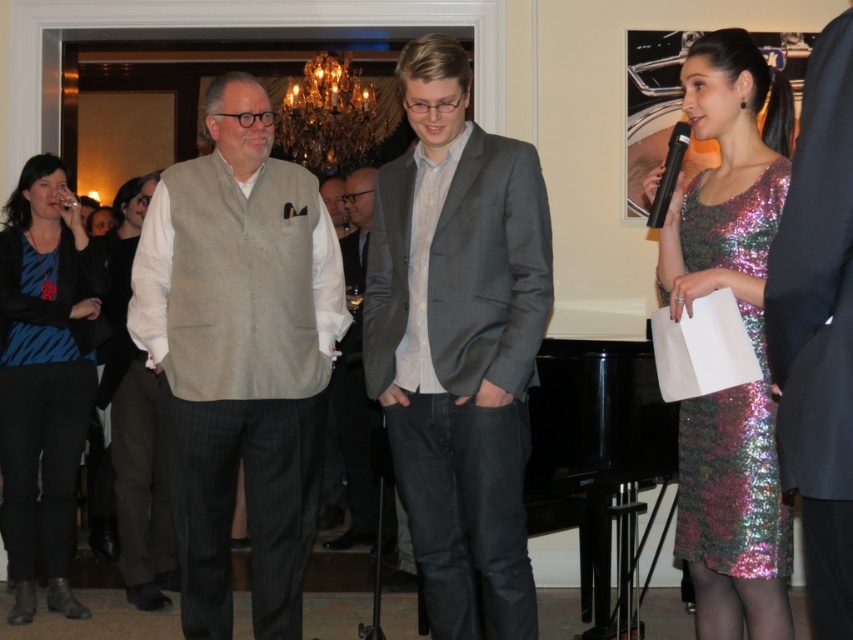
You are a photographer trying to capture a candid shot of the two people represented by the points in the image. The first point is at coordinate point (109, 321) and the second is at point (352, 218). Since you want to focus on the person closer to the camera, which point should you aim your camera at?

Point (109, 321) is closer to the camera than point (352, 218), so you should aim your camera at point (109, 321) to focus on the person closer to the camera.

You are standing at the point labeled as point (717, 561) and want to move to the exit located at point (486, 595). Is the exit directly in front of you or behind you?

The exit at point (486, 595) is behind point (717, 561), so the exit is behind you.